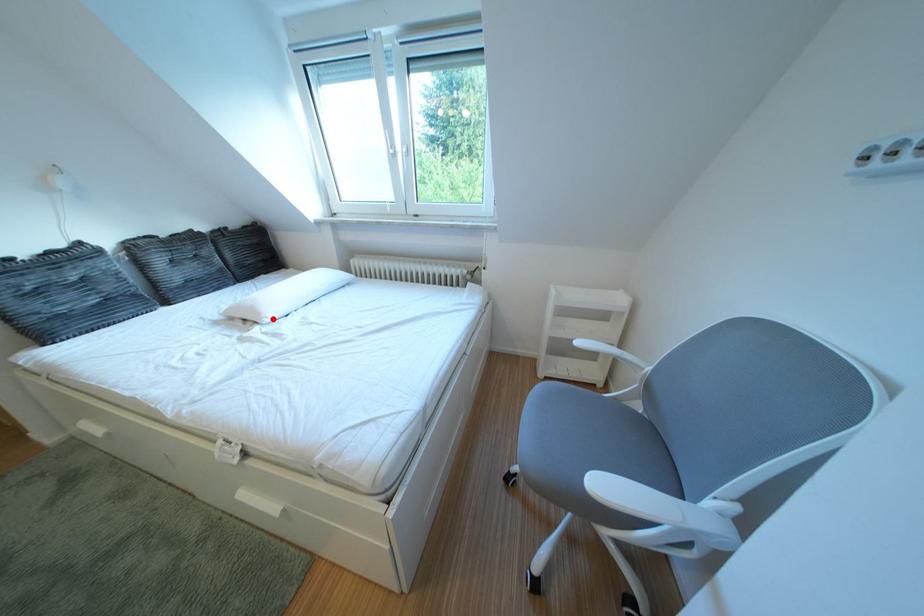
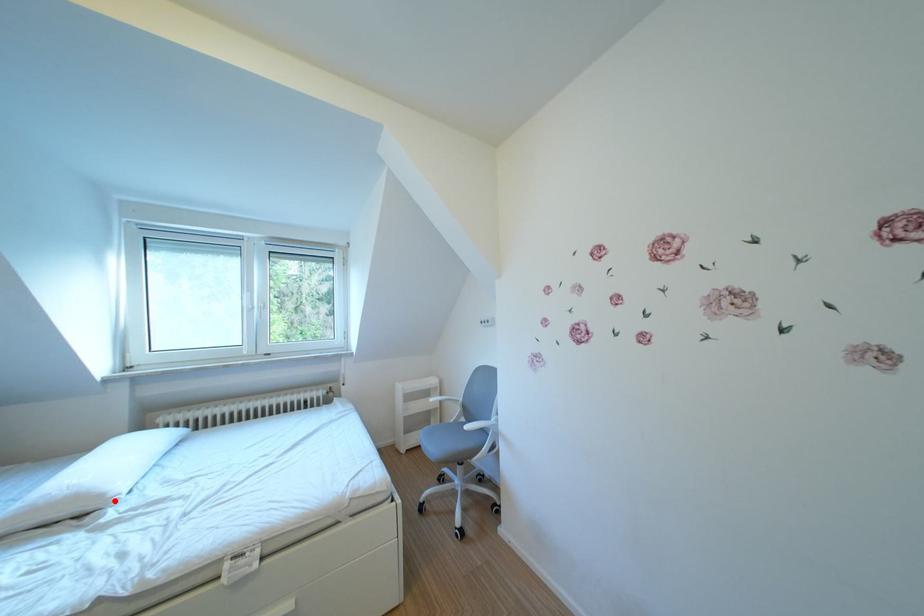
I am providing you with two images of the same scene from different viewpoints. A red point is marked on the first image and another point is marked on the second image. Do the highlighted points in image1 and image2 indicate the same real-world spot?

Yes